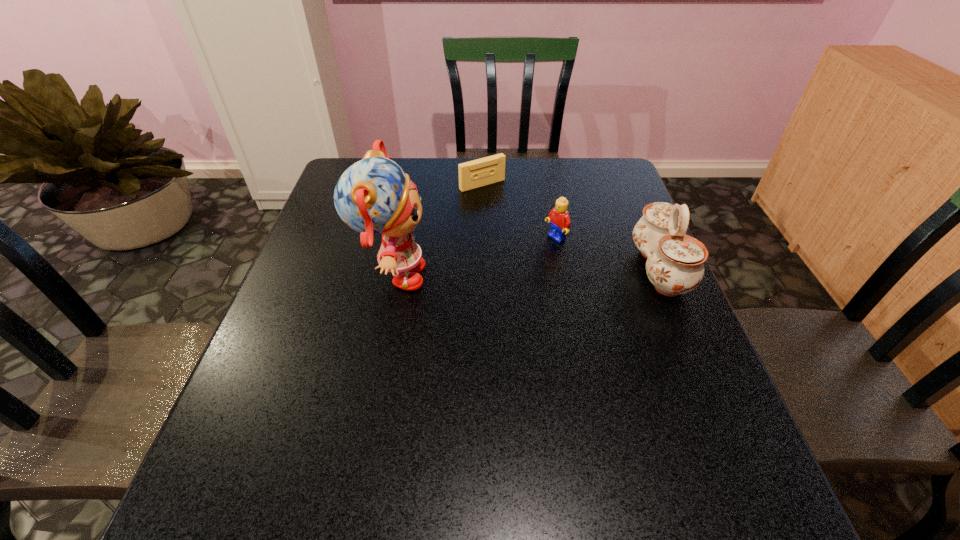
At what (x,y) coordinates should I click in order to perform the action: click on empty location between the doll and the videotape. Please return your answer as a coordinate pair (x, y). Image resolution: width=960 pixels, height=540 pixels. Looking at the image, I should click on (438, 231).

This screenshot has width=960, height=540. In order to click on free space between the farthest object and the Lego in this screenshot , I will do `click(518, 212)`.

In order to click on vacant space that is in between the leftmost object and the second shortest object in this screenshot , I will do `click(474, 258)`.

Identify which object is the closest to the tallest object. Please provide its 2D coordinates. Your answer should be formatted as a tuple, i.e. [(x, y)], where the tuple contains the x and y coordinates of a point satisfying the conditions above.

[(488, 170)]

Select which object appears as the closest to the Lego. Please provide its 2D coordinates. Your answer should be formatted as a tuple, i.e. [(x, y)], where the tuple contains the x and y coordinates of a point satisfying the conditions above.

[(675, 261)]

Locate an element on the screen. free space that satisfies the following two spatial constraints: 1. on the front side of the third object from right to left; 2. by the handle of the chinaware is located at coordinates (483, 269).

Find the location of a particular element. Image resolution: width=960 pixels, height=540 pixels. blank space that satisfies the following two spatial constraints: 1. on the front side of the chinaware; 2. by the handle of the second shortest object is located at coordinates 561,269.

Locate an element on the screen. blank space that satisfies the following two spatial constraints: 1. on the front side of the chinaware; 2. by the handle of the third object from left to right is located at coordinates (561, 269).